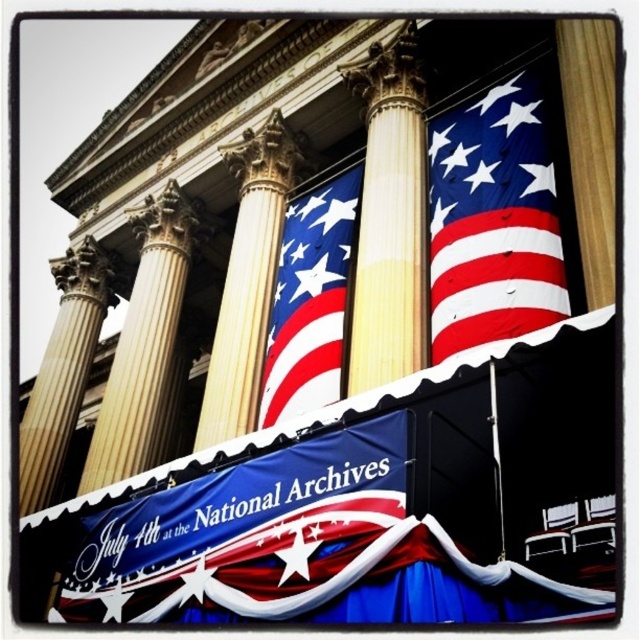
You are a visitor standing in front of the National Archives building. You notice two columns at the center of the facade. Which one is taller, the beige marble column at center or the golden polished column at center?

The beige marble column at center is much taller than the golden polished column at center.

You are a visitor standing in front of the National Archives building. You see the blue fabric banner at center and the wooden column at center. Which object is located higher up in the image?

The wooden column at center is located higher up in the image because the blue fabric banner at center is positioned under it.

You are a photographer standing in front of the National Archives building. You want to take a photo that includes the polyester american flag at upper right. Where should you position yourself to ensure the flag is centered in your shot?

To center the polyester american flag at upper right in your photo, position yourself directly in front of the building at the point corresponding to the flag at coordinates 0.345 on the horizontal axis and 0.770 on the vertical axis.